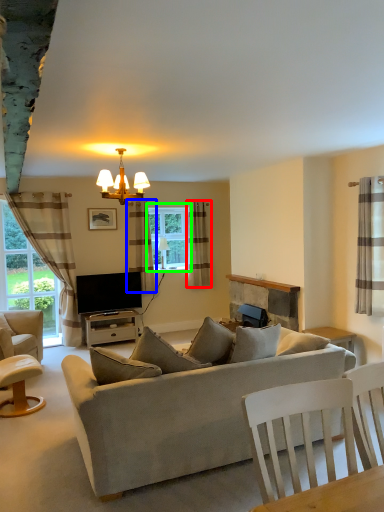
Question: Which object is positioned farthest from curtain (highlighted by a red box)? Select from curtain (highlighted by a blue box) and window (highlighted by a green box).

Choices:
 (A) curtain
 (B) window

Answer: (A)